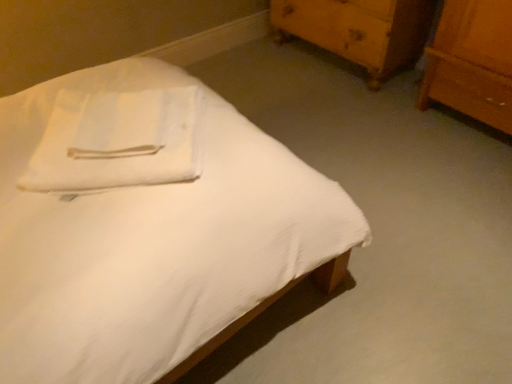
This screenshot has width=512, height=384. Find the location of `vacant region above white cotton towel at upper left (from a real-world perspective)`. vacant region above white cotton towel at upper left (from a real-world perspective) is located at coordinates (127, 112).